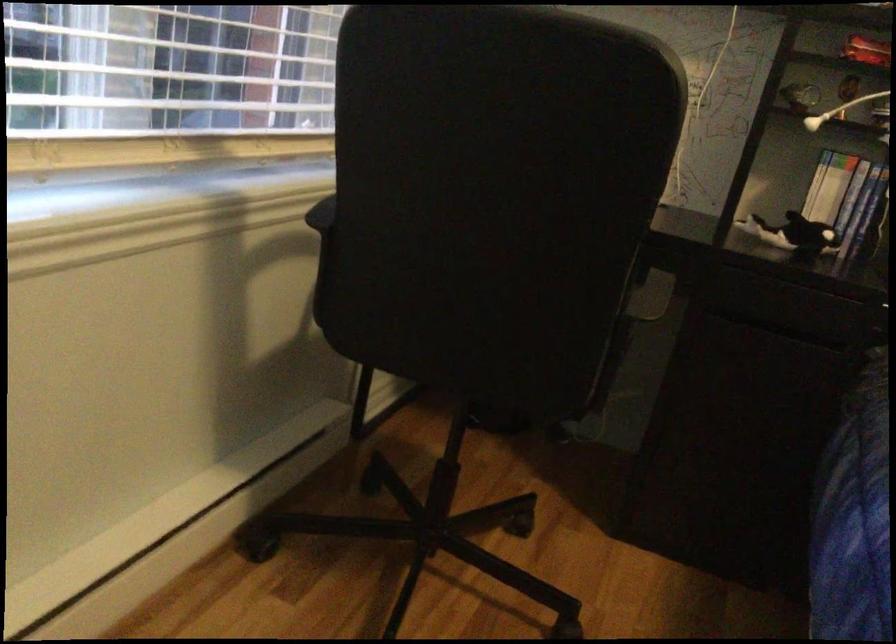
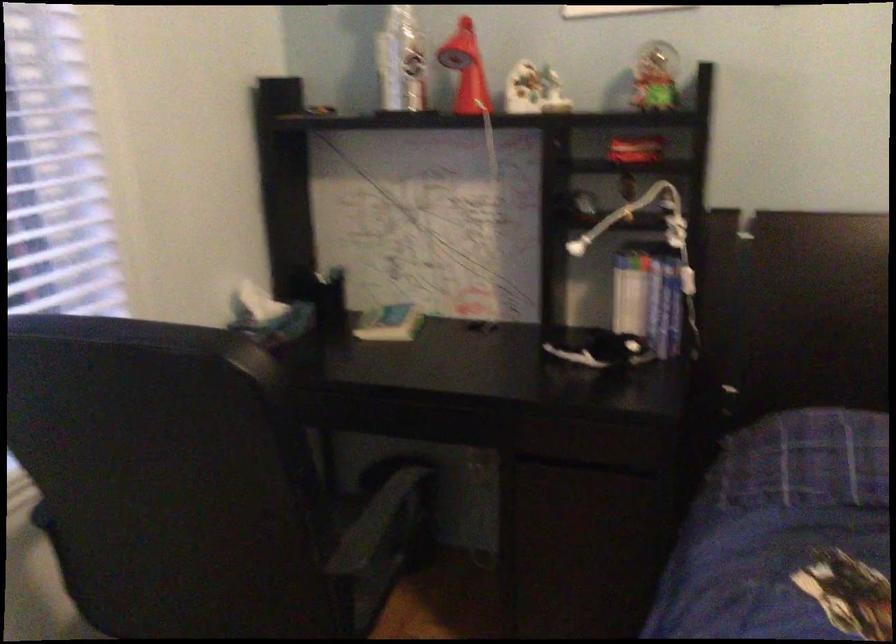
Question: In a continuous first-person perspective shot, in which direction is the camera moving?

Choices:
 (A) Left
 (B) Right
 (C) Forward
 (D) Backward

Answer: (B)